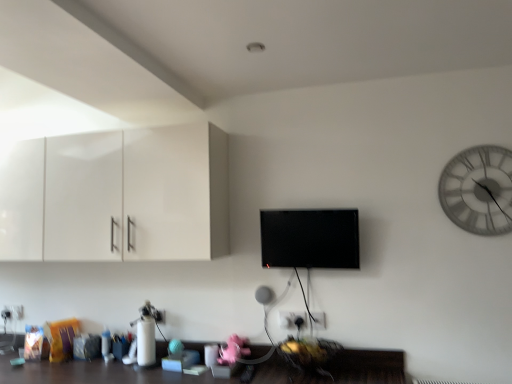
Question: Considering the relative positions of black glossy flat screen tv at center and white plastic electric outlet at lower center, which is the 2th electric outlet in left-to-right order, in the image provided, is black glossy flat screen tv at center to the left of white plastic electric outlet at lower center, which is the 2th electric outlet in left-to-right order, from the viewer's perspective?

Choices:
 (A) no
 (B) yes

Answer: (B)

Question: Is black glossy flat screen tv at center outside white plastic electric outlet at lower center, placed as the second electric outlet when sorted from back to front?

Choices:
 (A) yes
 (B) no

Answer: (A)

Question: Is white plastic electric outlet at lower center, the first electric outlet when ordered from right to left, located within black glossy flat screen tv at center?

Choices:
 (A) no
 (B) yes

Answer: (A)

Question: From a real-world perspective, is black glossy flat screen tv at center below white plastic electric outlet at lower center, placed as the second electric outlet when sorted from back to front?

Choices:
 (A) no
 (B) yes

Answer: (A)

Question: From the image's perspective, would you say black glossy flat screen tv at center is positioned over white plastic electric outlet at lower center, which is the 2th electric outlet in left-to-right order?

Choices:
 (A) yes
 (B) no

Answer: (A)

Question: Does black glossy flat screen tv at center have a lesser height compared to white plastic electric outlet at lower center, which is counted as the 1th electric outlet, starting from the top?

Choices:
 (A) yes
 (B) no

Answer: (B)

Question: Is white plastic electric outlet at lower left, acting as the second electric outlet starting from the top, taller than black glossy flat screen tv at center?

Choices:
 (A) yes
 (B) no

Answer: (B)

Question: Is white plastic electric outlet at lower left, placed as the 2th electric outlet when sorted from right to left, bigger than black glossy flat screen tv at center?

Choices:
 (A) yes
 (B) no

Answer: (B)

Question: From a real-world perspective, is white plastic electric outlet at lower left, which appears as the first electric outlet when viewed from the left, positioned under black glossy flat screen tv at center based on gravity?

Choices:
 (A) no
 (B) yes

Answer: (B)

Question: Is white plastic electric outlet at lower left, placed as the 2th electric outlet when sorted from right to left, not near black glossy flat screen tv at center?

Choices:
 (A) no
 (B) yes

Answer: (B)

Question: Considering the relative sizes of white plastic electric outlet at lower left, acting as the second electric outlet starting from the top, and black glossy flat screen tv at center in the image provided, is white plastic electric outlet at lower left, acting as the second electric outlet starting from the top, shorter than black glossy flat screen tv at center?

Choices:
 (A) no
 (B) yes

Answer: (B)

Question: Is white plastic electric outlet at lower left, which appears as the first electric outlet when viewed from the left, positioned with its back to black glossy flat screen tv at center?

Choices:
 (A) no
 (B) yes

Answer: (A)

Question: Does white glass clock at upper right lie behind white glossy cabinet at upper left?

Choices:
 (A) yes
 (B) no

Answer: (B)